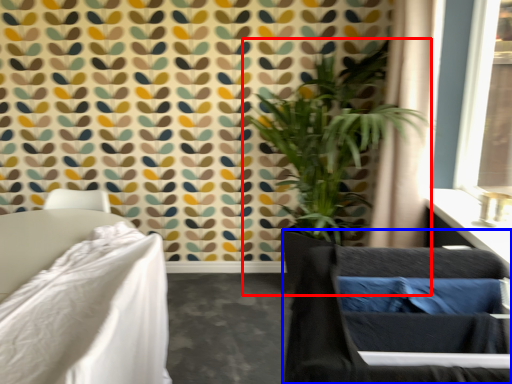
Question: Which object is closer to the camera taking this photo, houseplant (highlighted by a red box) or swivel chair (highlighted by a blue box)?

Choices:
 (A) houseplant
 (B) swivel chair

Answer: (B)